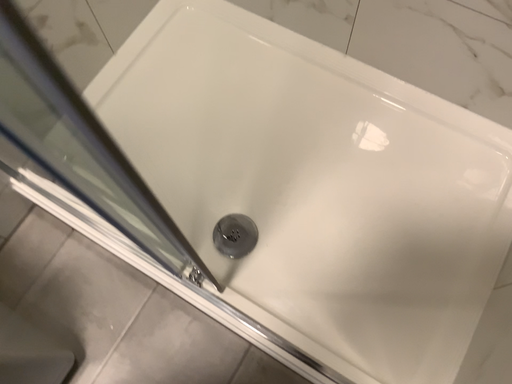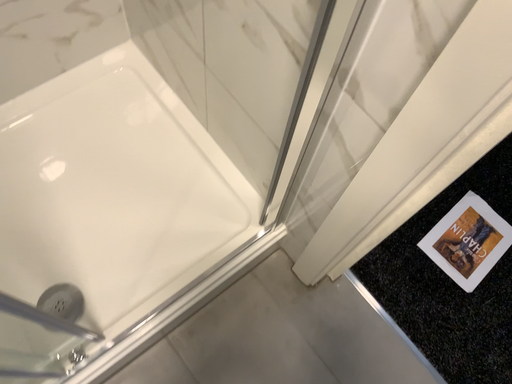
Question: How did the camera likely rotate when shooting the video?

Choices:
 (A) rotated left
 (B) rotated right

Answer: (B)